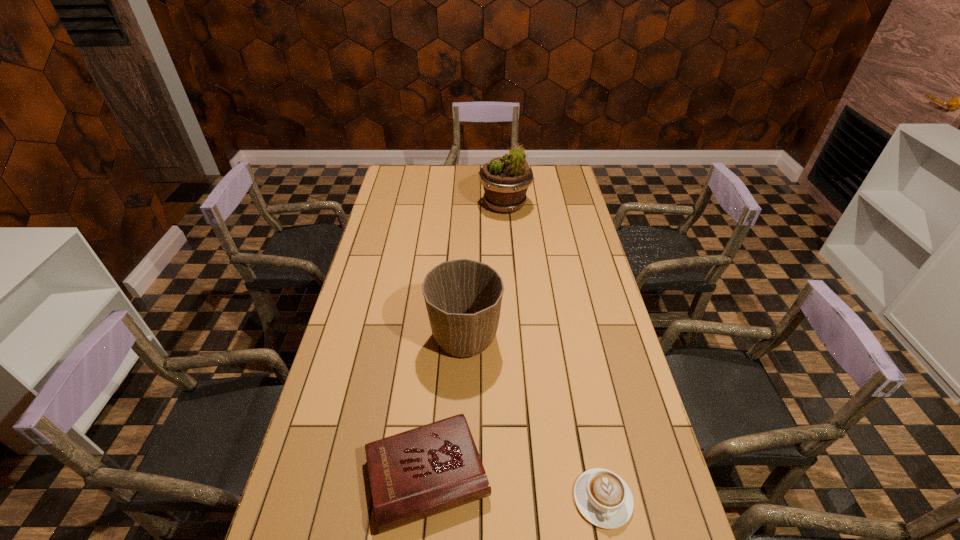
This screenshot has width=960, height=540. Identify the location of the farther flowerpot. (505, 180).

At what (x,y) coordinates should I click in order to perform the action: click on the tallest object. Please return your answer as a coordinate pair (x, y). This screenshot has height=540, width=960. Looking at the image, I should click on (505, 180).

Image resolution: width=960 pixels, height=540 pixels. In order to click on the shorter flowerpot in this screenshot , I will do `click(463, 297)`.

Identify the location of the third nearest object. The height and width of the screenshot is (540, 960). (463, 297).

At what (x,y) coordinates should I click in order to perform the action: click on hardback book. Please return your answer as a coordinate pair (x, y). Looking at the image, I should click on (430, 469).

Where is `cappuccino`? The height and width of the screenshot is (540, 960). cappuccino is located at coordinates (603, 498).

Image resolution: width=960 pixels, height=540 pixels. In order to click on vacant space located on the left of the farthest object in this screenshot , I will do `click(445, 205)`.

You are a GUI agent. You are given a task and a screenshot of the screen. Output one action in this format:
    pyautogui.click(x=<x>, y=<y>)
    Task: Click on the vacant space located 0.100m on the right of the third nearest object
    This screenshot has width=960, height=540.
    Given the screenshot: What is the action you would take?
    pyautogui.click(x=533, y=336)

Where is `vacant area situated 0.360m on the right of the hardback book`? vacant area situated 0.360m on the right of the hardback book is located at coordinates (636, 474).

This screenshot has height=540, width=960. In order to click on object positioned at the right edge in this screenshot , I will do [603, 498].